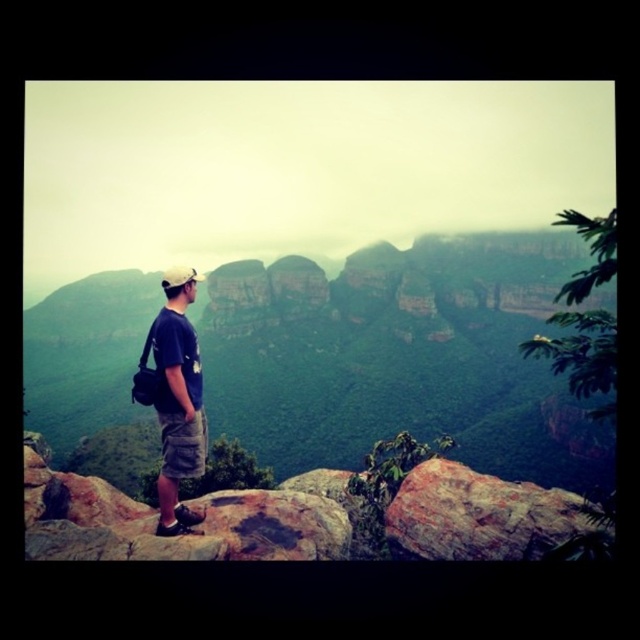
Is rugged stone mountain at center shorter than dark blue t-shirt at center?

Incorrect, rugged stone mountain at center's height does not fall short of dark blue t-shirt at center's.

Which is behind, point (465, 304) or point (163, 456)?

Positioned behind is point (465, 304).

Locate an element on the screen. rugged stone mountain at center is located at coordinates (401, 356).